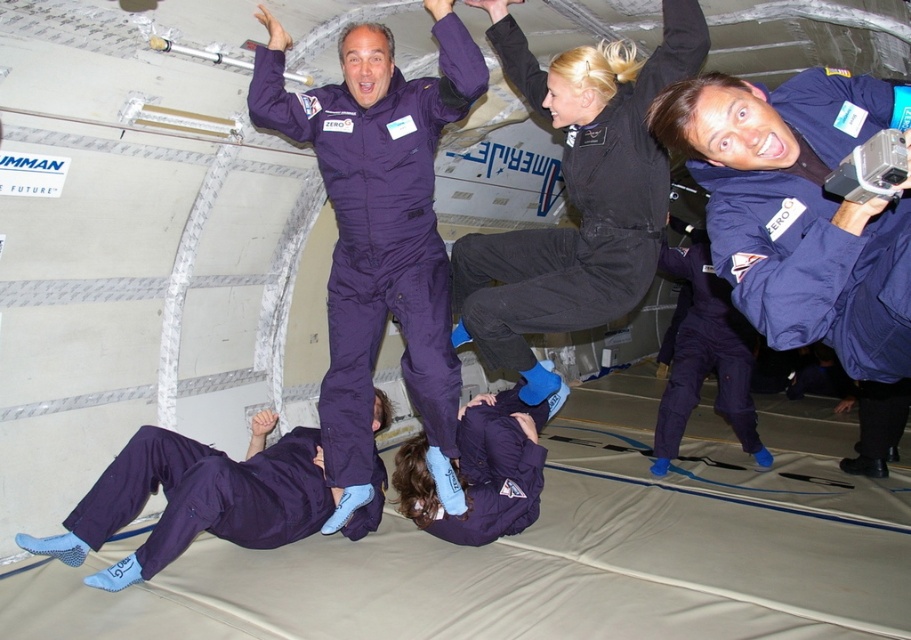
Question: Which point is farther to the camera?

Choices:
 (A) black smooth jumpsuit at upper center
 (B) matte blue jumpsuit at center
 (C) matte blue jumpsuit at upper right
 (D) purple smooth jumpsuit at upper center

Answer: (C)

Question: Is purple smooth jumpsuit at upper center positioned in front of black smooth jumpsuit at upper center?

Choices:
 (A) yes
 (B) no

Answer: (B)

Question: Is the position of purple smooth jumpsuit at upper center more distant than that of black smooth jumpsuit at upper center?

Choices:
 (A) yes
 (B) no

Answer: (A)

Question: Which point is closer to the camera taking this photo?

Choices:
 (A) (669, 33)
 (B) (281, 115)
 (C) (836, 218)

Answer: (C)

Question: Does purple smooth jumpsuit at upper center have a smaller size compared to matte blue jumpsuit at upper right?

Choices:
 (A) no
 (B) yes

Answer: (B)

Question: Which object is the farthest from the matte blue jumpsuit at center?

Choices:
 (A) black smooth jumpsuit at upper center
 (B) purple smooth jumpsuit at upper center
 (C) matte blue jumpsuit at upper right

Answer: (C)